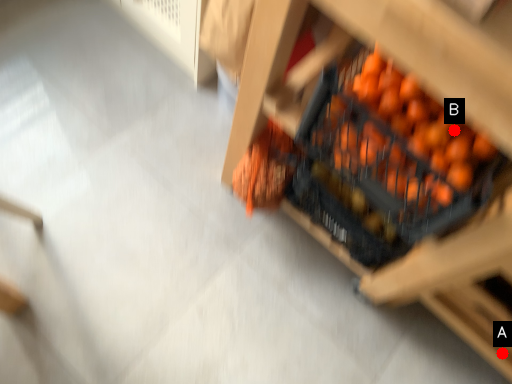
Question: Two points are circled on the image, labeled by A and B beside each circle. Which point is further to the camera?

Choices:
 (A) A is further
 (B) B is further

Answer: (A)